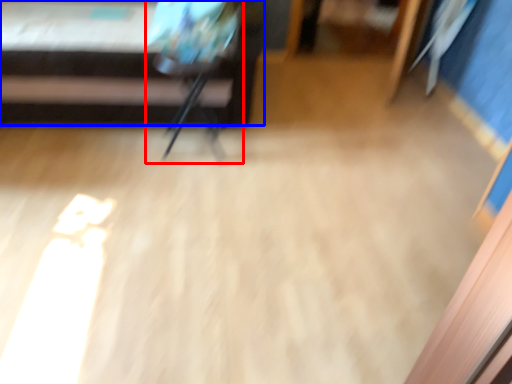
Question: Among these objects, which one is nearest to the camera, armchair (highlighted by a red box) or furniture (highlighted by a blue box)?

Choices:
 (A) armchair
 (B) furniture

Answer: (B)